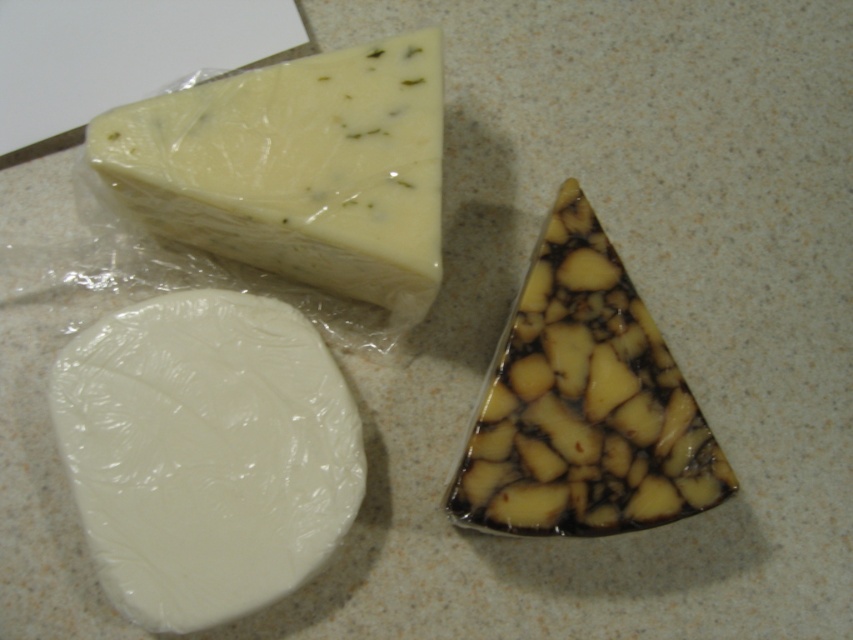
Can you confirm if yellowish-white creamy cheese at upper left is shorter than brown marbled cheese at center?

Yes.

How far apart are yellowish-white creamy cheese at upper left and brown marbled cheese at center?

They are 11.77 inches apart.

I want to click on yellowish-white creamy cheese at upper left, so click(297, 168).

Does point (93, 352) lie behind point (329, 122)?

Yes, point (93, 352) is farther from viewer.

Between point (201, 525) and point (321, 260), which one is positioned behind?

The point (321, 260) is behind.

At what (x,y) coordinates should I click in order to perform the action: click on white matte round cheese at lower left. Please return your answer as a coordinate pair (x, y). The width and height of the screenshot is (853, 640). Looking at the image, I should click on (206, 452).

Is white matte round cheese at lower left taller than brown marbled cheese at center?

No, white matte round cheese at lower left is not taller than brown marbled cheese at center.

Identify the location of white matte round cheese at lower left. This screenshot has height=640, width=853. (206, 452).